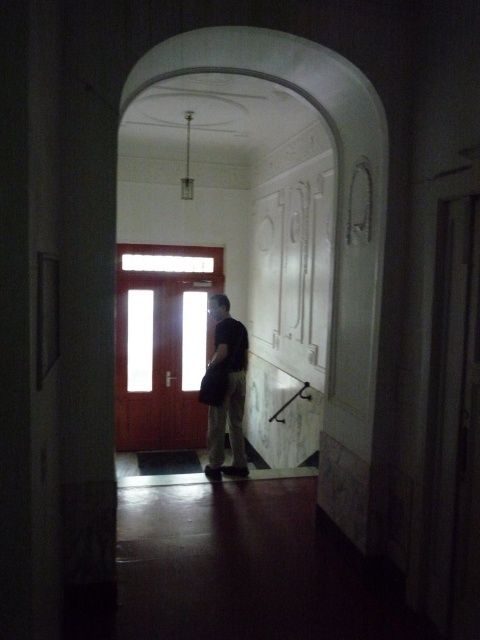
Question: Which point is closer to the camera?

Choices:
 (A) (211, 360)
 (B) (171, 445)

Answer: (A)

Question: Which of the following is the farthest from the observer?

Choices:
 (A) wooden door at center
 (B) dark gray fabric bag at center

Answer: (A)

Question: Observing the image, what is the correct spatial positioning of wooden door at center in reference to dark gray fabric bag at center?

Choices:
 (A) right
 (B) left

Answer: (B)

Question: Is wooden door at center to the right of dark gray fabric bag at center from the viewer's perspective?

Choices:
 (A) yes
 (B) no

Answer: (B)

Question: Is wooden door at center wider than dark gray fabric bag at center?

Choices:
 (A) yes
 (B) no

Answer: (A)